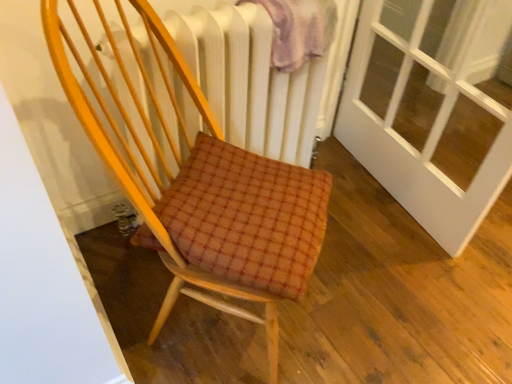
Where is `vacant area that lies to the right of white textured radiator at upper center`? vacant area that lies to the right of white textured radiator at upper center is located at coordinates (369, 238).